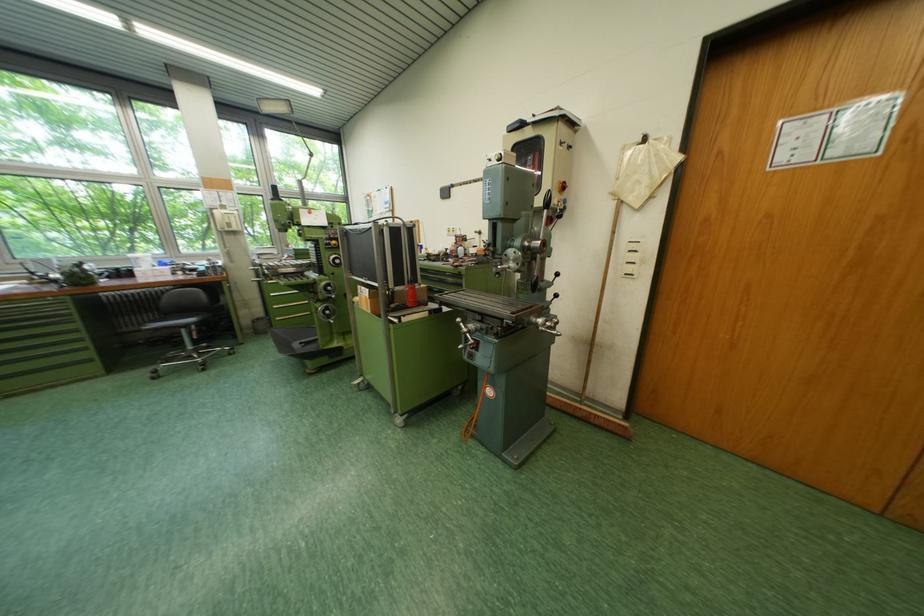
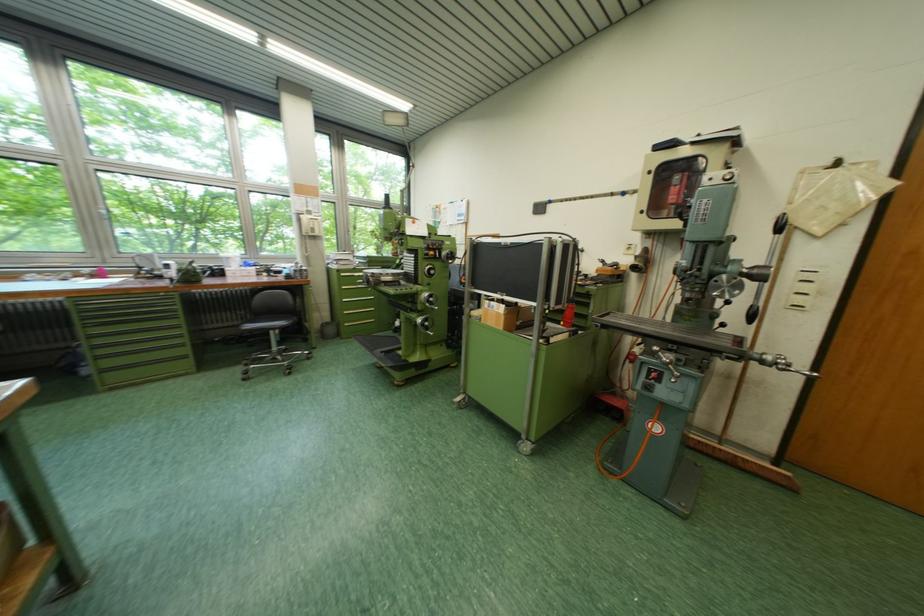
Where in the second image is the point corresponding to (x=317, y=304) from the first image?

(383, 312)